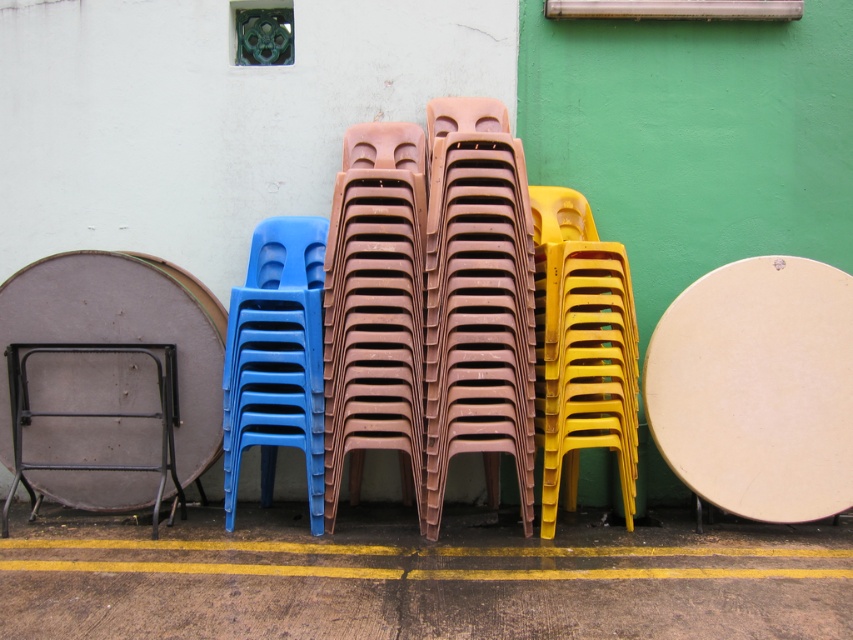
Question: Is matte plastic chairs at center below yellow plastic chair at right?

Choices:
 (A) yes
 (B) no

Answer: (B)

Question: Is the position of matte plastic chairs at center more distant than that of yellow plastic chair at right?

Choices:
 (A) no
 (B) yes

Answer: (A)

Question: Considering the relative positions of matte plastic chairs at center and yellow plastic chair at right in the image provided, where is matte plastic chairs at center located with respect to yellow plastic chair at right?

Choices:
 (A) left
 (B) right

Answer: (A)

Question: Which object is the farthest from the yellow plastic chair at right?

Choices:
 (A) matte plastic chairs at center
 (B) matte plastic chair at center

Answer: (B)

Question: Which of the following is the farthest from the observer?

Choices:
 (A) brown plastic chairs at center
 (B) yellow plastic chair at right
 (C) black metal folding table at lower left

Answer: (C)

Question: Among these objects, which one is farthest from the camera?

Choices:
 (A) matte plastic chair at center
 (B) matte plastic chairs at center

Answer: (A)